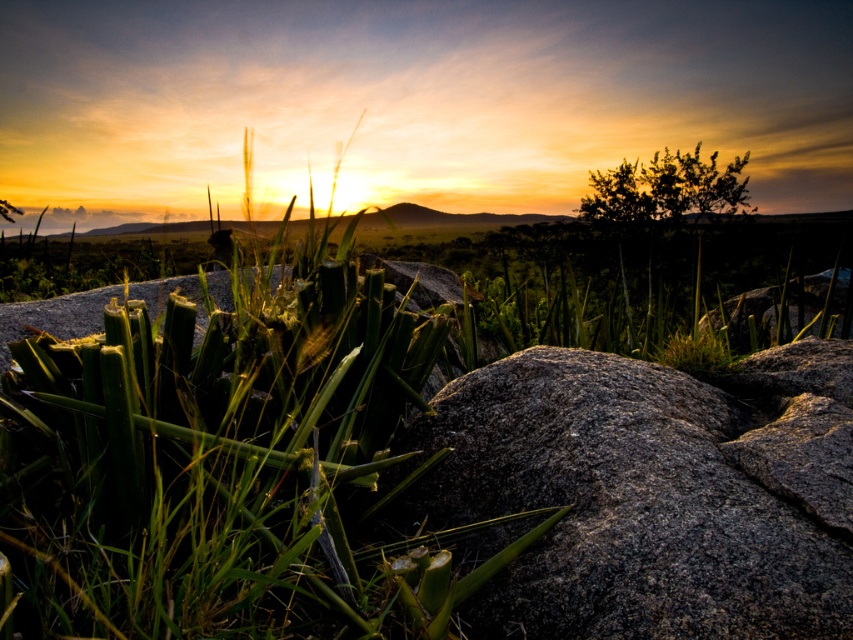
You are a gardener who wants to plant a new flower between the green rough grass at center and the granite rock at center. The flower requires at least 24 inches of space to grow properly. Based on the scene, will there be enough space between them to accommodate the flower?

The green rough grass at center and granite rock at center are 25.27 inches apart, which is more than the required 24 inches. Therefore, there is sufficient space to plant the flower between them.

You are a drone operator trying to capture a closeup of the green rough grass at center. The drone is currently at the position of the sun in the image. What direction should you move the drone to get closer to the grass?

The green rough grass at center is located at point 0.717 on the x axis and 0.256 on the y axis. Since the sun is at the top of the image, moving the drone downward and to the right would bring it closer to the grass.